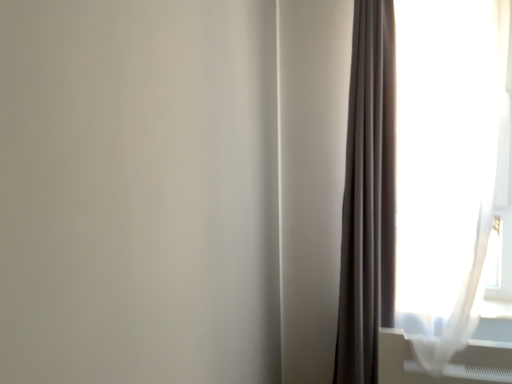
The image size is (512, 384). What do you see at coordinates (368, 196) in the screenshot? I see `matte gray curtain at right, arranged as the 1th curtain when viewed from the left` at bounding box center [368, 196].

Identify the location of matte gray curtain at right, arranged as the 1th curtain when viewed from the left. This screenshot has height=384, width=512. (368, 196).

This screenshot has height=384, width=512. Identify the location of white sheer curtain at right, which is the second curtain from left to right. (419, 185).

What do you see at coordinates (419, 185) in the screenshot?
I see `white sheer curtain at right, the first curtain in the right-to-left sequence` at bounding box center [419, 185].

What is the approximate height of white sheer curtain at right, which is the second curtain from left to right?

It is 1.99 meters.

Locate an element on the screen. Image resolution: width=512 pixels, height=384 pixels. matte gray curtain at right, the second curtain in the right-to-left sequence is located at coordinates (368, 196).

Which object is positioned more to the left, white sheer curtain at right, which is the second curtain from left to right, or matte gray curtain at right, the second curtain in the right-to-left sequence?

Positioned to the left is matte gray curtain at right, the second curtain in the right-to-left sequence.

Considering their positions, is white sheer curtain at right, the first curtain in the right-to-left sequence, located in front of or behind matte gray curtain at right, arranged as the 1th curtain when viewed from the left?

Visually, white sheer curtain at right, the first curtain in the right-to-left sequence, is located in front of matte gray curtain at right, arranged as the 1th curtain when viewed from the left.

Which point is more distant from viewer, (422, 372) or (385, 296)?

The point (385, 296) is more distant.

From the image's perspective, between white sheer curtain at right, which is the second curtain from left to right, and matte gray curtain at right, arranged as the 1th curtain when viewed from the left, who is located below?

white sheer curtain at right, which is the second curtain from left to right, is shown below in the image.

From a real-world perspective, who is located higher, white sheer curtain at right, which is the second curtain from left to right, or matte gray curtain at right, arranged as the 1th curtain when viewed from the left?

From a 3D spatial view, white sheer curtain at right, which is the second curtain from left to right, is above.

From the picture: In terms of width, does white sheer curtain at right, which is the second curtain from left to right, look wider or thinner when compared to matte gray curtain at right, the second curtain in the right-to-left sequence?

white sheer curtain at right, which is the second curtain from left to right, is wider than matte gray curtain at right, the second curtain in the right-to-left sequence.

In terms of height, does white sheer curtain at right, the first curtain in the right-to-left sequence, look taller or shorter compared to matte gray curtain at right, arranged as the 1th curtain when viewed from the left?

Considering their sizes, white sheer curtain at right, the first curtain in the right-to-left sequence, has less height than matte gray curtain at right, arranged as the 1th curtain when viewed from the left.

Considering the relative sizes of white sheer curtain at right, which is the second curtain from left to right, and matte gray curtain at right, the second curtain in the right-to-left sequence, in the image provided, is white sheer curtain at right, which is the second curtain from left to right, bigger than matte gray curtain at right, the second curtain in the right-to-left sequence,?

Indeed, white sheer curtain at right, which is the second curtain from left to right, has a larger size compared to matte gray curtain at right, the second curtain in the right-to-left sequence.

Is white sheer curtain at right, the first curtain in the right-to-left sequence, surrounding matte gray curtain at right, the second curtain in the right-to-left sequence?

No, matte gray curtain at right, the second curtain in the right-to-left sequence, is not inside white sheer curtain at right, the first curtain in the right-to-left sequence.

Is white sheer curtain at right, the first curtain in the right-to-left sequence, next to matte gray curtain at right, the second curtain in the right-to-left sequence, and touching it?

They are not placed beside each other.

Is white sheer curtain at right, the first curtain in the right-to-left sequence, looking in the opposite direction of matte gray curtain at right, arranged as the 1th curtain when viewed from the left?

No, white sheer curtain at right, the first curtain in the right-to-left sequence, is not facing away from matte gray curtain at right, arranged as the 1th curtain when viewed from the left.

Locate an element on the screen. curtain that is behind the white sheer curtain at right, which is the second curtain from left to right is located at coordinates (368, 196).

Does matte gray curtain at right, arranged as the 1th curtain when viewed from the left, appear on the right side of white sheer curtain at right, the first curtain in the right-to-left sequence?

No, matte gray curtain at right, arranged as the 1th curtain when viewed from the left, is not to the right of white sheer curtain at right, the first curtain in the right-to-left sequence.

Considering the positions of objects matte gray curtain at right, arranged as the 1th curtain when viewed from the left, and white sheer curtain at right, which is the second curtain from left to right, in the image provided, who is in front, matte gray curtain at right, arranged as the 1th curtain when viewed from the left, or white sheer curtain at right, which is the second curtain from left to right,?

white sheer curtain at right, which is the second curtain from left to right, is in front.

Considering the points (359, 366) and (412, 102), which point is behind, point (359, 366) or point (412, 102)?

The point (359, 366) is more distant.

From the image's perspective, is matte gray curtain at right, the second curtain in the right-to-left sequence, on white sheer curtain at right, the first curtain in the right-to-left sequence?

Yes, from the image's perspective, matte gray curtain at right, the second curtain in the right-to-left sequence, is above white sheer curtain at right, the first curtain in the right-to-left sequence.

From a real-world perspective, is matte gray curtain at right, the second curtain in the right-to-left sequence, positioned above or below white sheer curtain at right, the first curtain in the right-to-left sequence?

From a real-world perspective, matte gray curtain at right, the second curtain in the right-to-left sequence, is physically below white sheer curtain at right, the first curtain in the right-to-left sequence.

Considering the sizes of matte gray curtain at right, the second curtain in the right-to-left sequence, and white sheer curtain at right, which is the second curtain from left to right, in the image, is matte gray curtain at right, the second curtain in the right-to-left sequence, wider or thinner than white sheer curtain at right, which is the second curtain from left to right,?

In the image, matte gray curtain at right, the second curtain in the right-to-left sequence, appears to be more narrow than white sheer curtain at right, which is the second curtain from left to right.

Considering the sizes of objects matte gray curtain at right, arranged as the 1th curtain when viewed from the left, and white sheer curtain at right, the first curtain in the right-to-left sequence, in the image provided, who is shorter, matte gray curtain at right, arranged as the 1th curtain when viewed from the left, or white sheer curtain at right, the first curtain in the right-to-left sequence,?

With less height is white sheer curtain at right, the first curtain in the right-to-left sequence.

Looking at the image, does matte gray curtain at right, the second curtain in the right-to-left sequence, seem bigger or smaller compared to white sheer curtain at right, which is the second curtain from left to right?

Considering their sizes, matte gray curtain at right, the second curtain in the right-to-left sequence, takes up less space than white sheer curtain at right, which is the second curtain from left to right.

Does matte gray curtain at right, the second curtain in the right-to-left sequence, contain white sheer curtain at right, which is the second curtain from left to right?

No.

Is matte gray curtain at right, arranged as the 1th curtain when viewed from the left, far away from white sheer curtain at right, which is the second curtain from left to right?

No, there isn't a large distance between matte gray curtain at right, arranged as the 1th curtain when viewed from the left, and white sheer curtain at right, which is the second curtain from left to right.

Is matte gray curtain at right, arranged as the 1th curtain when viewed from the left, positioned with its back to white sheer curtain at right, the first curtain in the right-to-left sequence?

No, matte gray curtain at right, arranged as the 1th curtain when viewed from the left, is not facing away from white sheer curtain at right, the first curtain in the right-to-left sequence.

You are a GUI agent. You are given a task and a screenshot of the screen. Output one action in this format:
    pyautogui.click(x=<x>, y=<y>)
    Task: Click on the curtain on the left of white sheer curtain at right, the first curtain in the right-to-left sequence
    
    Given the screenshot: What is the action you would take?
    pyautogui.click(x=368, y=196)

This screenshot has height=384, width=512. Find the location of `curtain behind the white sheer curtain at right, which is the second curtain from left to right`. curtain behind the white sheer curtain at right, which is the second curtain from left to right is located at coordinates (368, 196).

What are the coordinates of `curtain below the matte gray curtain at right, arranged as the 1th curtain when viewed from the left (from the image's perspective)` in the screenshot? It's located at (419, 185).